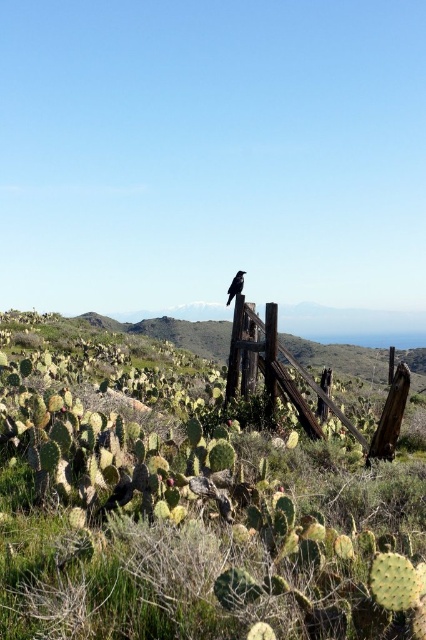
Describe the element at coordinates (189, 506) in the screenshot. I see `green spiny cactus at center` at that location.

Is green spiny cactus at center bigger than black glossy bird at upper center?

Yes, green spiny cactus at center is bigger than black glossy bird at upper center.

Find the location of a particular element. This screenshot has width=426, height=640. green spiny cactus at center is located at coordinates (189, 506).

The width and height of the screenshot is (426, 640). In order to click on green spiny cactus at center in this screenshot , I will do `click(189, 506)`.

The height and width of the screenshot is (640, 426). What do you see at coordinates (189, 506) in the screenshot?
I see `green spiny cactus at center` at bounding box center [189, 506].

Can you confirm if green spiny cactus at center is thinner than rusty wood fence at center?

No.

Between point (190, 374) and point (268, 364), which one is positioned in front?

Point (268, 364)

This screenshot has width=426, height=640. What are the coordinates of `green spiny cactus at center` in the screenshot? It's located at (189, 506).

This screenshot has width=426, height=640. In order to click on rusty wood fence at center in this screenshot , I will do `click(262, 358)`.

Which is below, rusty wood fence at center or black glossy bird at upper center?

rusty wood fence at center is lower down.

Who is more distant from viewer, (299, 396) or (233, 284)?

The point (233, 284) is more distant.

Find the location of a particular element. rusty wood fence at center is located at coordinates (262, 358).